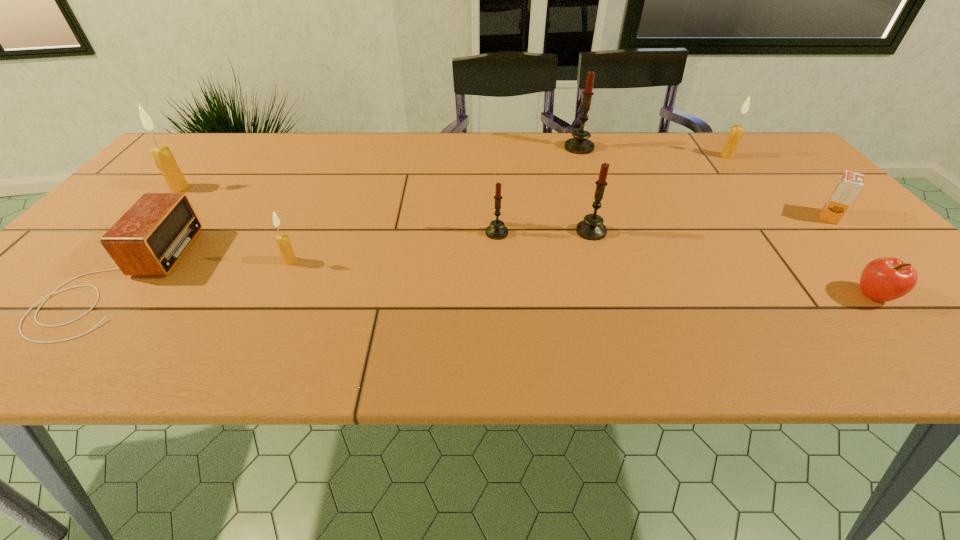
Identify the location of object that stands as the closest to the second biggest red candle. (496, 230).

Identify which object is located as the fifth nearest to the pink apple. Please provide its 2D coordinates. Your answer should be formatted as a tuple, i.e. [(x, y)], where the tuple contains the x and y coordinates of a point satisfying the conditions above.

[(496, 230)]

Identify which candle is the closest to the biggest red candle. Please provide its 2D coordinates. Your answer should be formatted as a tuple, i.e. [(x, y)], where the tuple contains the x and y coordinates of a point satisfying the conditions above.

[(591, 228)]

Identify which candle is the fourth nearest to the sixth object from right to left. Please provide its 2D coordinates. Your answer should be formatted as a tuple, i.e. [(x, y)], where the tuple contains the x and y coordinates of a point satisfying the conditions above.

[(736, 132)]

Identify which red candle is located as the nearest to the biggest red candle. Please provide its 2D coordinates. Your answer should be formatted as a tuple, i.e. [(x, y)], where the tuple contains the x and y coordinates of a point satisfying the conditions above.

[(591, 228)]

Find the location of a particular element. Image resolution: width=960 pixels, height=540 pixels. the second closest red candle to the sixth object from right to left is located at coordinates (580, 144).

In order to click on cream candle that is the second closest one to the biggest red candle in this screenshot , I will do `click(284, 244)`.

At what (x,y) coordinates should I click in order to perform the action: click on cream candle that can be found as the closest to the third object from right to left. Please return your answer as a coordinate pair (x, y). This screenshot has height=540, width=960. Looking at the image, I should click on pyautogui.click(x=284, y=244).

At what (x,y) coordinates should I click in order to perform the action: click on free spot that satisfies the following two spatial constraints: 1. on the back side of the seventh object from left to right; 2. on the right side of the fourth nearest candle. Please return your answer as a coordinate pair (x, y). This screenshot has width=960, height=540. Looking at the image, I should click on (207, 156).